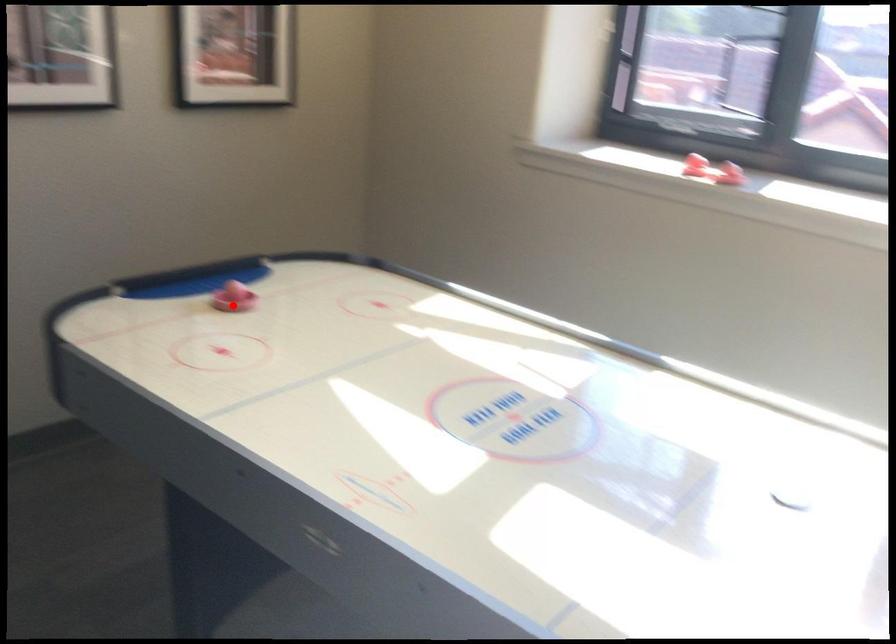
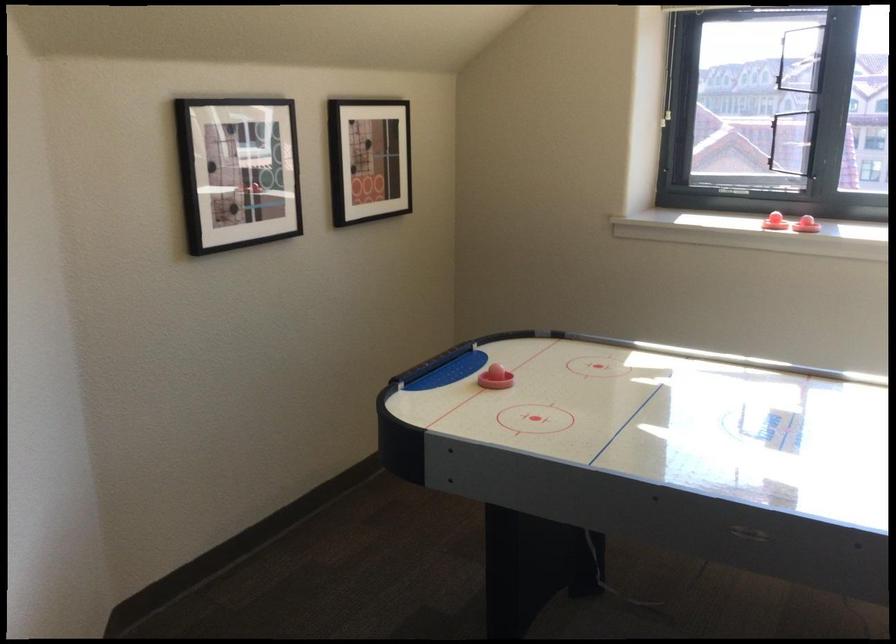
Question: A red point is marked in image1. In image2, is the corresponding 3D point closer to the camera or farther? Reply with the corresponding letter.

Choices:
 (A) The corresponding 3D point is closer.
 (B) The corresponding 3D point is farther.

Answer: (B)